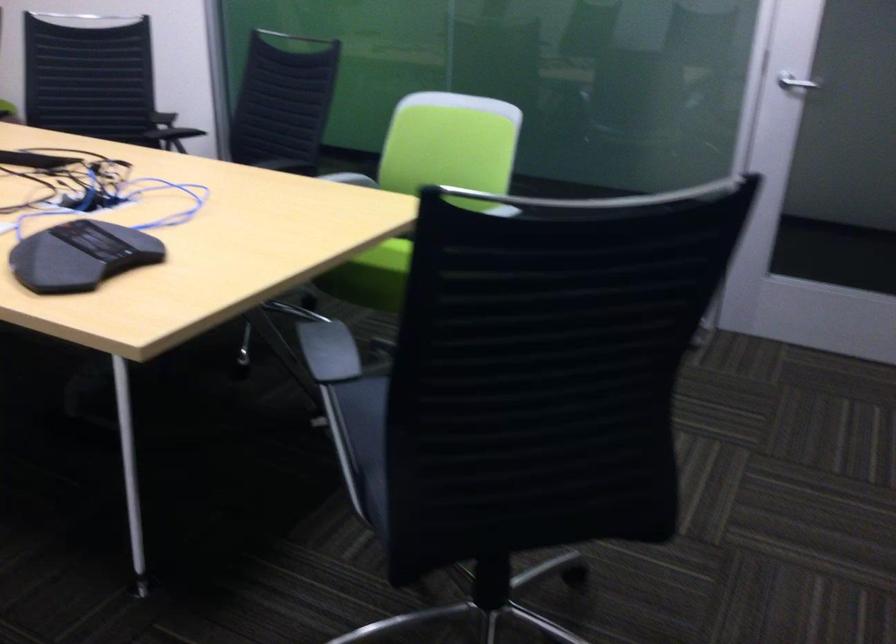
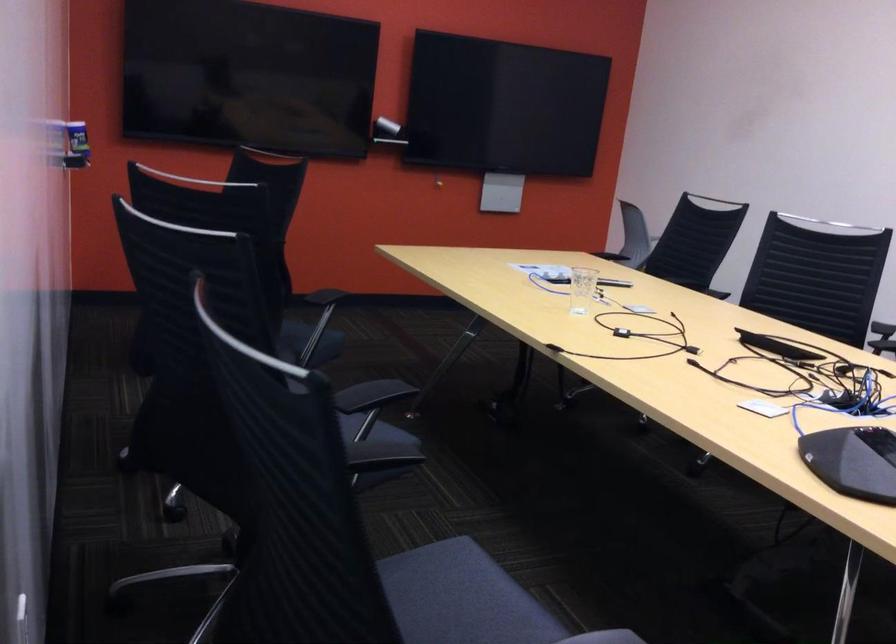
Question: The camera is either moving clockwise (left) or counter-clockwise (right) around the object. The first image is from the beginning of the video and the second image is from the end. Is the camera moving left or right when shooting the video?

Choices:
 (A) Left
 (B) Right

Answer: (B)